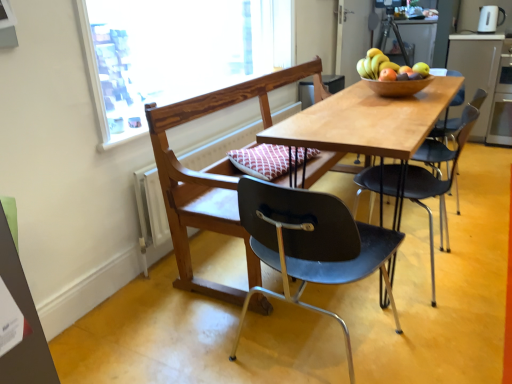
Question: In terms of height, does shiny brown bowl at upper right, acting as the 2th fruit starting from the right, look taller or shorter compared to smooth yellow pear at upper right, arranged as the 1th fruit when viewed from the right?

Choices:
 (A) tall
 (B) short

Answer: (A)

Question: From a real-world perspective, relative to smooth yellow pear at upper right, which ranks as the 2th fruit in left-to-right order, is shiny brown bowl at upper right, acting as the 2th fruit starting from the right, vertically above or below?

Choices:
 (A) above
 (B) below

Answer: (A)

Question: Which of these objects is positioned closest to the matte black chair at center, which appears as the first chair when viewed from the front?

Choices:
 (A) green cardboard bulletin board at lower left
 (B) matte black chair at center, arranged as the 1th chair when viewed from the back
 (C) wooden table at center
 (D) shiny brown bowl at upper right, which is the first fruit in left-to-right order
 (E) white glossy electric kettle at upper right

Answer: (C)

Question: Which object is the farthest from the shiny brown bowl at upper right, which is the first fruit in left-to-right order?

Choices:
 (A) wooden chair at center, which appears as the 2th chair when viewed from the front
 (B) wooden bowl at upper center
 (C) wooden table at center
 (D) green cardboard bulletin board at lower left
 (E) smooth yellow pear at upper right, which ranks as the 2th fruit in left-to-right order

Answer: (D)